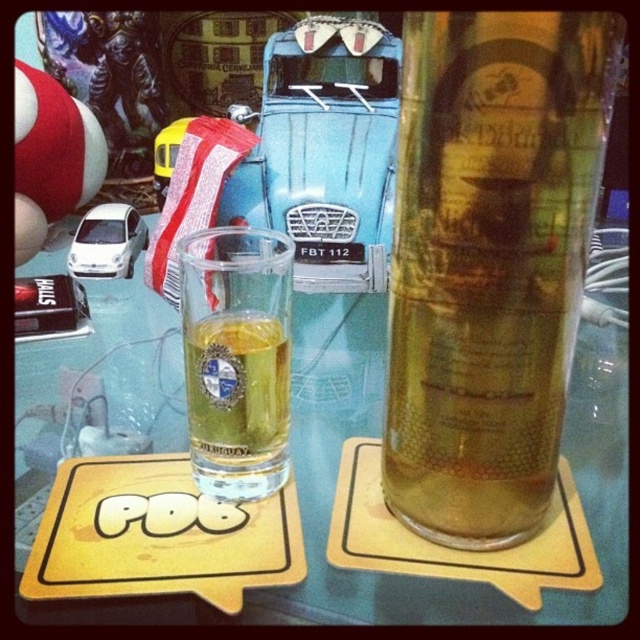
Can you confirm if translucent glass beer at center is positioned below clear glass shot glass at center?

No, translucent glass beer at center is not below clear glass shot glass at center.

Who is more forward, (397, 198) or (288, 305)?

Positioned in front is point (397, 198).

Find the location of a particular element. The image size is (640, 640). translucent glass beer at center is located at coordinates (490, 260).